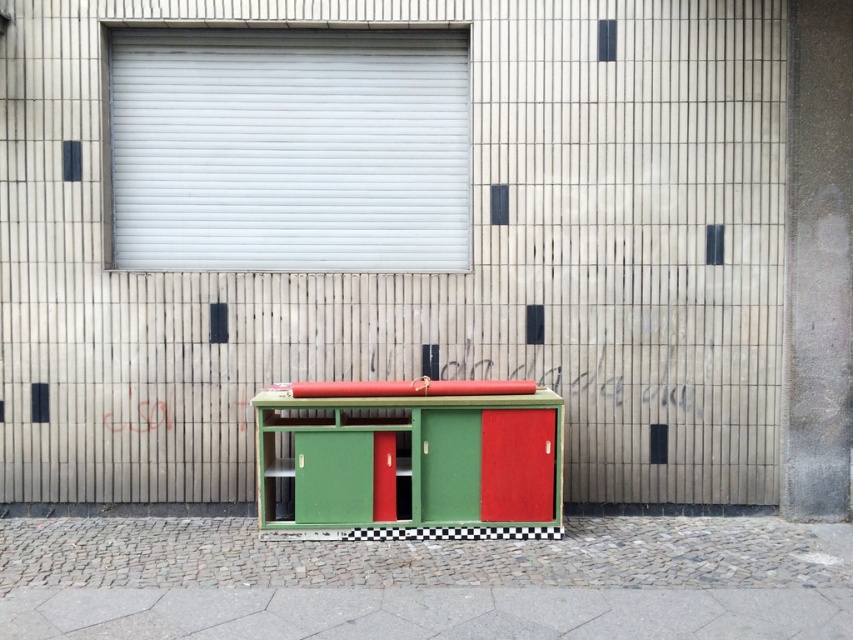
Question: Which point is farther to the camera?

Choices:
 (A) (758, 556)
 (B) (466, 440)

Answer: (B)

Question: Is cobblestone pavement at lower center positioned behind green matte cabinet at center?

Choices:
 (A) yes
 (B) no

Answer: (B)

Question: In this image, where is cobblestone pavement at lower center located relative to green matte cabinet at center?

Choices:
 (A) right
 (B) left

Answer: (A)

Question: Is cobblestone pavement at lower center below green matte cabinet at center?

Choices:
 (A) yes
 (B) no

Answer: (A)